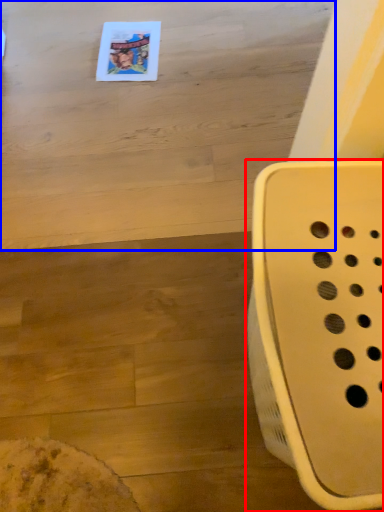
Question: Which point is further to the camera, furniture (highlighted by a red box) or table (highlighted by a blue box)?

Choices:
 (A) furniture
 (B) table

Answer: (B)